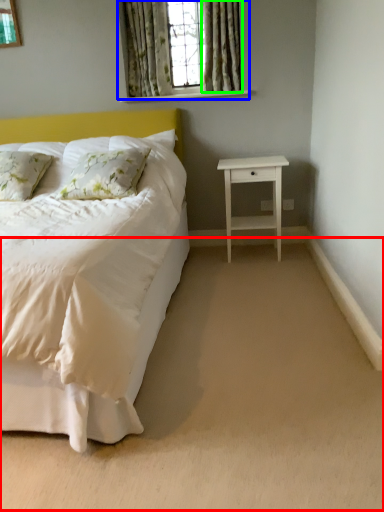
Question: Which is nearer to the plain (highlighted by a red box)? window (highlighted by a blue box) or curtain (highlighted by a green box).

Choices:
 (A) window
 (B) curtain

Answer: (B)